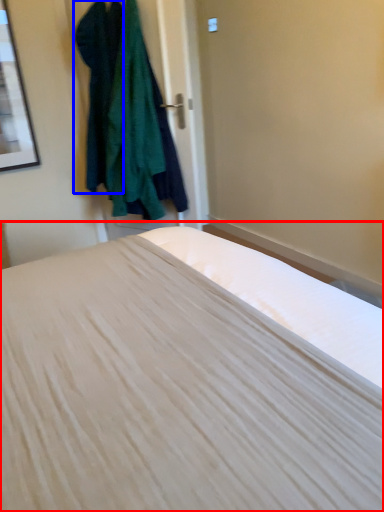
Question: Which point is closer to the camera, bed (highlighted by a red box) or clothing (highlighted by a blue box)?

Choices:
 (A) bed
 (B) clothing

Answer: (A)